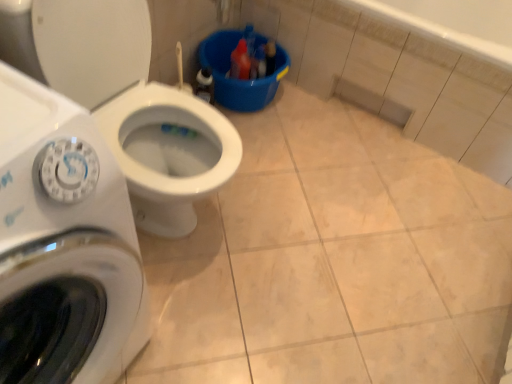
Question: Should I look upward or downward to see white glossy washing machine at left?

Choices:
 (A) down
 (B) up

Answer: (A)

Question: Considering the relative sizes of white glossy washing machine at left and white glossy toilet at center-left in the image provided, is white glossy washing machine at left shorter than white glossy toilet at center-left?

Choices:
 (A) yes
 (B) no

Answer: (B)

Question: Considering the relative sizes of white glossy washing machine at left and white glossy toilet at center-left in the image provided, is white glossy washing machine at left wider than white glossy toilet at center-left?

Choices:
 (A) yes
 (B) no

Answer: (B)

Question: From a real-world perspective, is white glossy washing machine at left on top of white glossy toilet at center-left?

Choices:
 (A) no
 (B) yes

Answer: (B)

Question: Can you confirm if white glossy washing machine at left is bigger than white glossy toilet at center-left?

Choices:
 (A) no
 (B) yes

Answer: (A)

Question: Is white glossy washing machine at left located outside white glossy toilet at center-left?

Choices:
 (A) no
 (B) yes

Answer: (B)

Question: From a real-world perspective, is white glossy washing machine at left beneath white glossy toilet at center-left?

Choices:
 (A) yes
 (B) no

Answer: (B)

Question: Considering the relative sizes of white glossy toilet at center-left and white glossy washing machine at left in the image provided, is white glossy toilet at center-left bigger than white glossy washing machine at left?

Choices:
 (A) no
 (B) yes

Answer: (B)

Question: Is white glossy toilet at center-left far away from white glossy washing machine at left?

Choices:
 (A) no
 (B) yes

Answer: (A)

Question: Could you tell me if white glossy toilet at center-left is facing white glossy washing machine at left?

Choices:
 (A) no
 (B) yes

Answer: (A)

Question: Is white glossy toilet at center-left looking in the opposite direction of white glossy washing machine at left?

Choices:
 (A) yes
 (B) no

Answer: (B)

Question: Considering the relative positions of white glossy toilet at center-left and white glossy washing machine at left in the image provided, is white glossy toilet at center-left to the left of white glossy washing machine at left from the viewer's perspective?

Choices:
 (A) yes
 (B) no

Answer: (B)

Question: From the image's perspective, is white glossy toilet at center-left below white glossy washing machine at left?

Choices:
 (A) yes
 (B) no

Answer: (B)

Question: From a real-world perspective, is white glossy washing machine at left positioned above or below white glossy toilet at center-left?

Choices:
 (A) above
 (B) below

Answer: (A)